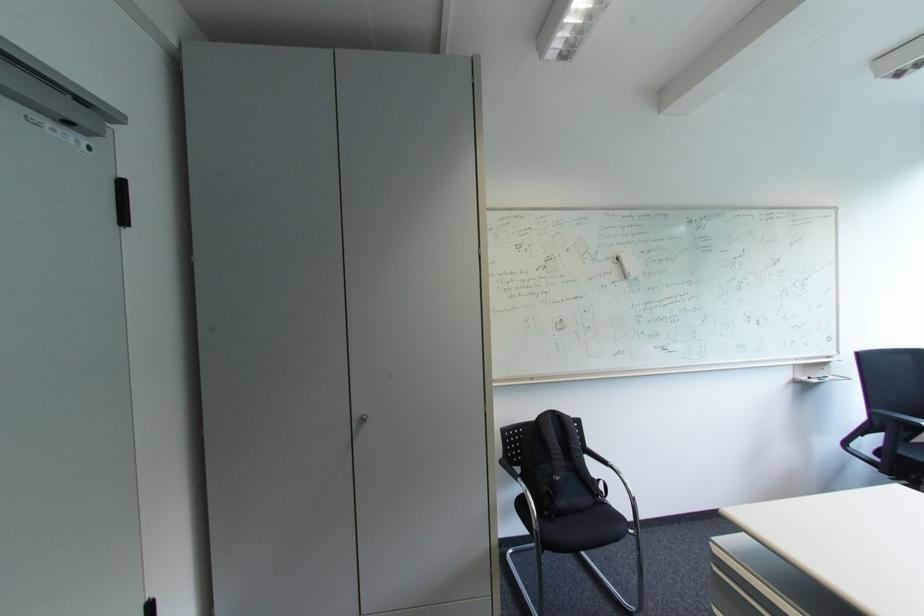
I want to click on black chair sitting surface, so click(585, 525).